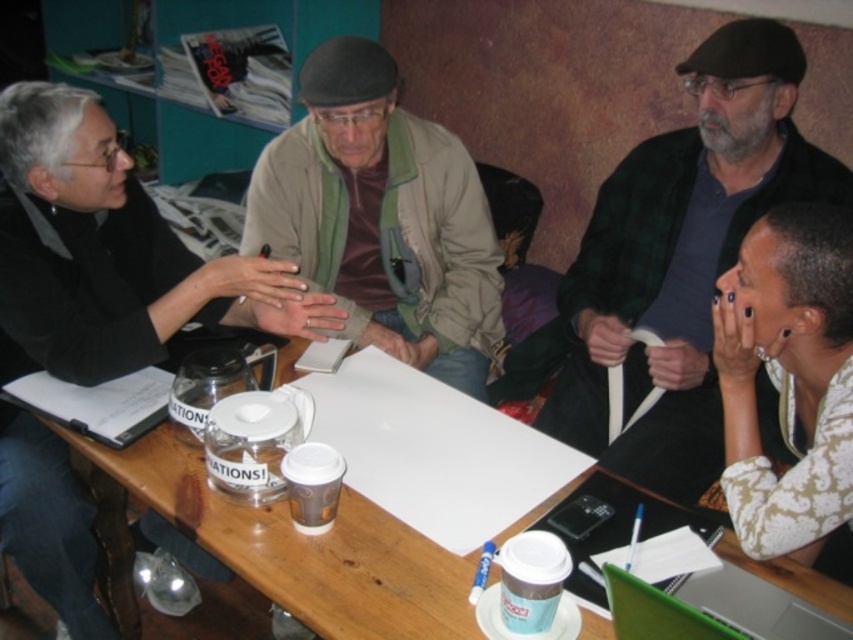
How much distance is there between wooden table at center and green matte laptop at lower right?

A distance of 13.87 inches exists between wooden table at center and green matte laptop at lower right.

Who is higher up, wooden table at center or green matte laptop at lower right?

Positioned higher is green matte laptop at lower right.

The height and width of the screenshot is (640, 853). What do you see at coordinates (277, 548) in the screenshot? I see `wooden table at center` at bounding box center [277, 548].

The height and width of the screenshot is (640, 853). In order to click on wooden table at center in this screenshot , I will do `click(277, 548)`.

Between green plaid jacket at upper right and wooden table at center, which one has more height?

With more height is green plaid jacket at upper right.

Is green plaid jacket at upper right below wooden table at center?

No, green plaid jacket at upper right is not below wooden table at center.

Is point (692, 131) farther from camera compared to point (221, 531)?

Yes, point (692, 131) is farther from viewer.

Locate an element on the screen. Image resolution: width=853 pixels, height=640 pixels. green plaid jacket at upper right is located at coordinates (680, 257).

Find the location of a particular element. The height and width of the screenshot is (640, 853). beige woolen sweater at center is located at coordinates [x=109, y=253].

Between beige woolen sweater at center and green plaid jacket at upper right, which one has less height?

green plaid jacket at upper right is shorter.

Between point (300, 330) and point (659, 228), which one is positioned in front?

Point (300, 330)

At what (x,y) coordinates should I click in order to perform the action: click on beige woolen sweater at center. Please return your answer as a coordinate pair (x, y). The height and width of the screenshot is (640, 853). Looking at the image, I should click on (109, 253).